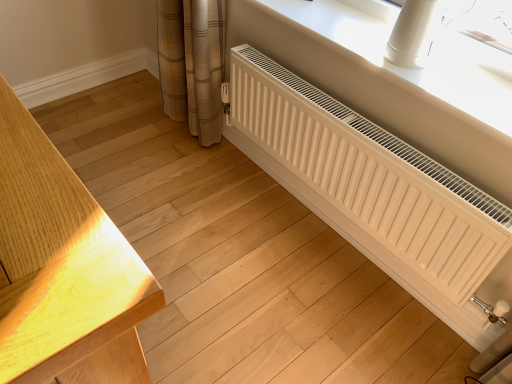
Question: Is white plastic radiator at lower right to the left or to the right of white matte radiator at lower right in the image?

Choices:
 (A) right
 (B) left

Answer: (A)

Question: Considering the positions of point (360, 36) and point (304, 86), is point (360, 36) closer or farther from the camera than point (304, 86)?

Choices:
 (A) farther
 (B) closer

Answer: (B)

Question: From their relative heights in the image, would you say white plastic radiator at lower right is taller or shorter than white matte radiator at lower right?

Choices:
 (A) tall
 (B) short

Answer: (B)

Question: Would you say white matte radiator at lower right is inside or outside white plastic radiator at lower right?

Choices:
 (A) outside
 (B) inside

Answer: (A)

Question: Considering the positions of point (457, 231) and point (375, 46), is point (457, 231) closer or farther from the camera than point (375, 46)?

Choices:
 (A) farther
 (B) closer

Answer: (B)

Question: Looking at their shapes, would you say white matte radiator at lower right is wider or thinner than white plastic radiator at lower right?

Choices:
 (A) wide
 (B) thin

Answer: (B)

Question: From a real-world perspective, is white matte radiator at lower right above or below white plastic radiator at lower right?

Choices:
 (A) below
 (B) above

Answer: (A)